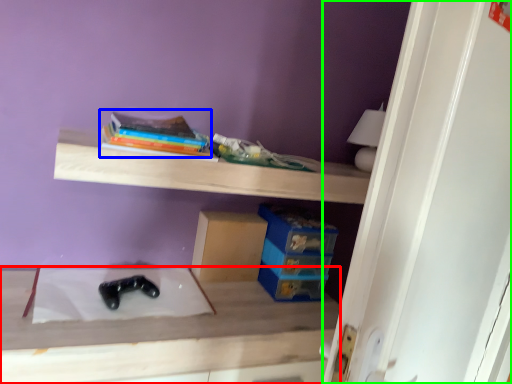
Question: Based on their relative distances, which object is farther from table (highlighted by a red box)? Choose from book (highlighted by a blue box) and door (highlighted by a green box).

Choices:
 (A) book
 (B) door

Answer: (B)